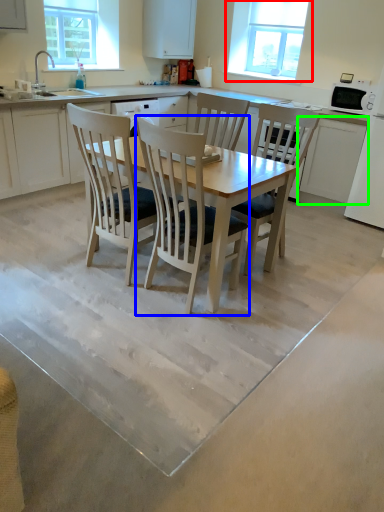
Question: Estimate the real-world distances between objects in this image. Which object is farther from window (highlighted by a red box), chair (highlighted by a blue box) or cabinetry (highlighted by a green box)?

Choices:
 (A) chair
 (B) cabinetry

Answer: (A)